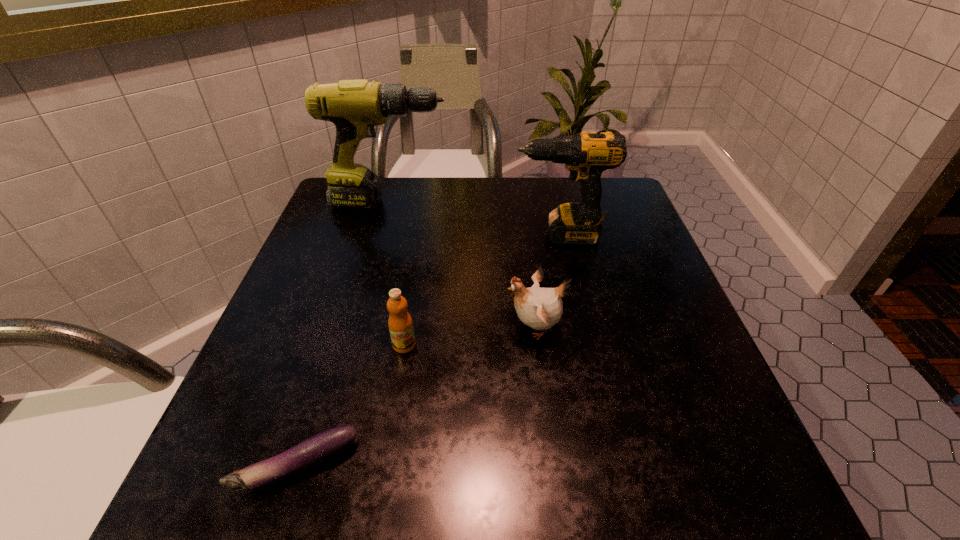
What are the coordinates of `free region located at the tip of the right drill` in the screenshot? It's located at (450, 235).

What are the coordinates of `free space located at the tip of the right drill` in the screenshot? It's located at (424, 235).

Find the location of a particular element. This screenshot has width=960, height=540. vacant space situated on the front label of the orange juice is located at coordinates (394, 409).

This screenshot has height=540, width=960. Identify the location of vacant space situated at the beak of the bird. (315, 327).

Find the location of a particular element. vacant area situated 0.160m at the beak of the bird is located at coordinates (420, 327).

This screenshot has width=960, height=540. In order to click on vacant space located at the beak of the bird in this screenshot , I will do `click(294, 327)`.

Identify the location of free space located on the back of the shortest object. This screenshot has width=960, height=540. (349, 300).

Locate an element on the screen. The height and width of the screenshot is (540, 960). object at the near edge is located at coordinates (321, 447).

The height and width of the screenshot is (540, 960). Find the location of `drill that is at the left edge`. drill that is at the left edge is located at coordinates (355, 107).

Find the location of a particular element. This screenshot has width=960, height=540. eggplant at the left edge is located at coordinates (321, 447).